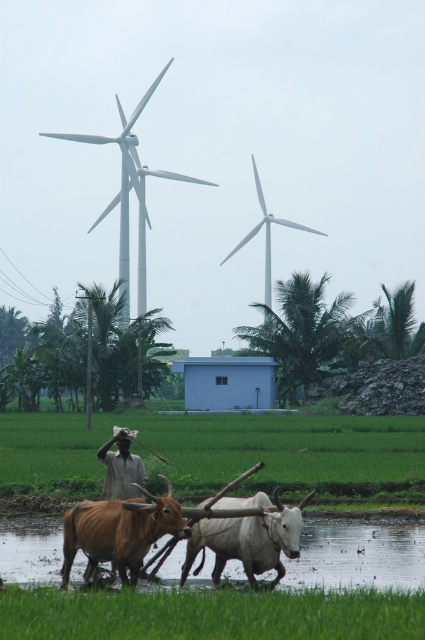
Looking at this image, you are a farmer in the scene. You need to decide which item to repair first between the light brown cotton shirt at center and the white matte windmill at center. Which one is bigger and requires more attention?

The white matte windmill at center is bigger than the light brown cotton shirt at center, so it requires more attention.

In the scene shown: You are a farmer standing at the origin point of the image. You need to locate the white glossy bull at center. In which direction should you move relative to your current position to reach it?

The white glossy bull at center is located at coordinates point [249,540]. Since the origin is at the bottom left corner, moving towards the right and slightly upward would lead you to the white glossy bull at center.

You are a farmer standing at the edge of the field. You need to check both the green grass at lower center and the brown glossy bull at lower left. Which one can you reach first without moving from your current position?

The green grass at lower center is in front of the brown glossy bull at lower left, so you can reach the green grass at lower center first without moving from your current position.